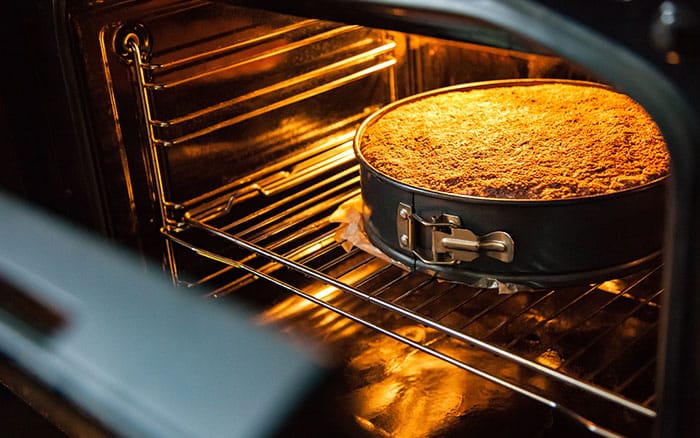
At what (x,y) coordinates should I click in order to perform the action: click on oven rack. Please return your answer as a coordinate pair (x, y). The image size is (700, 438). Looking at the image, I should click on (264, 273), (258, 251).